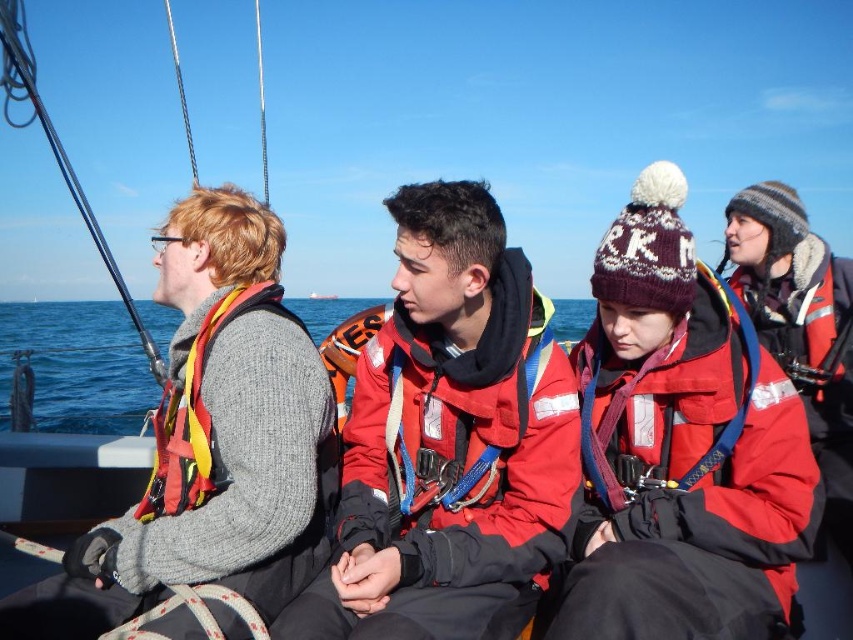
You are standing on the deck of a boat and see the red matte jacket at center. If you want to throw a rope to someone wearing the jacket, will you need to throw it more than 6 meters?

The red matte jacket at center is 6.75 meters away from camera, so yes, you will need to throw the rope more than 6 meters.

You are on a boat and need to quickly grab either the red matte jacket at center or the matte red life jacket at right. Which one is closer to you?

The red matte jacket at center is closer because it is in front of the matte red life jacket at right.